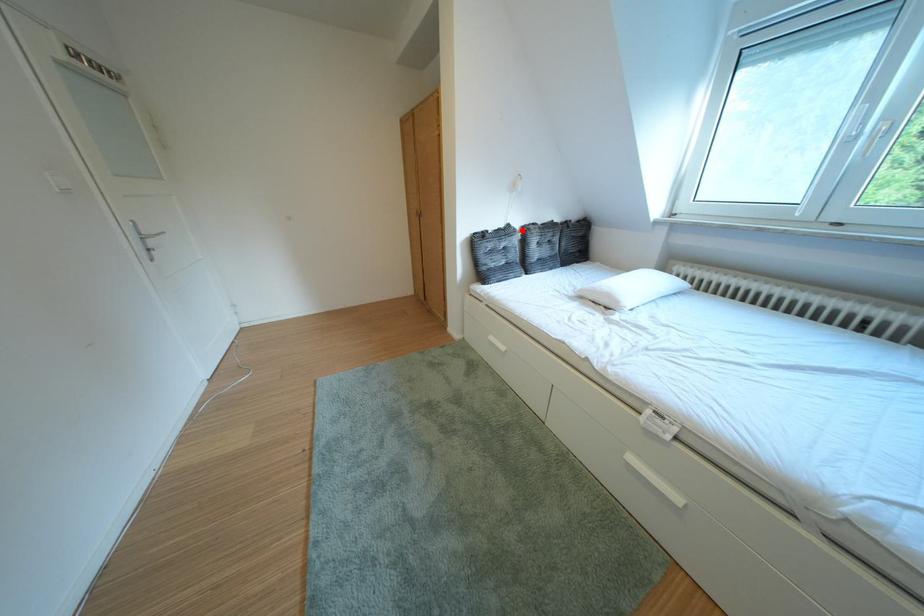
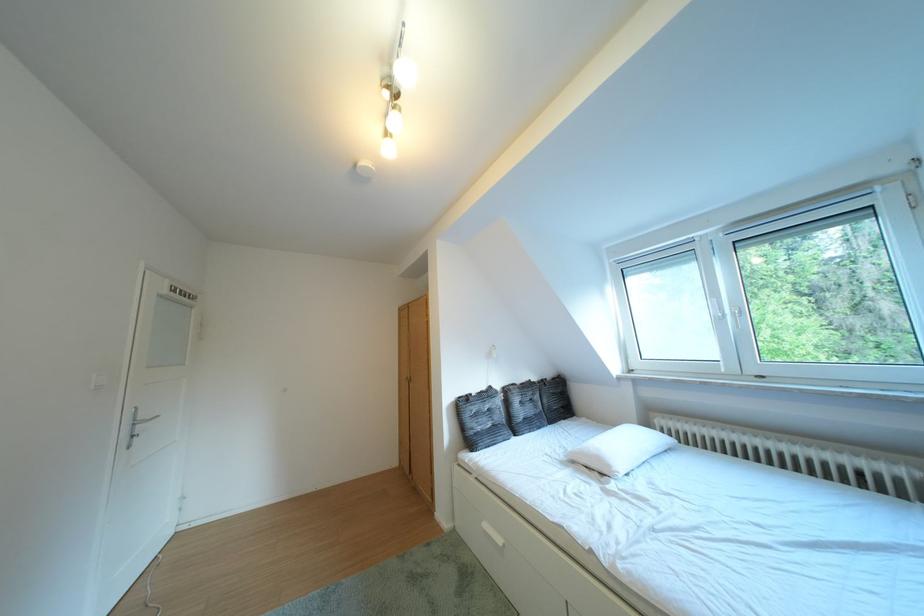
Question: I am providing you with two images of the same scene from different viewpoints. In image1, a red point is highlighted. Considering the same 3D point in image2, which of the following is correct?

Choices:
 (A) It is closer
 (B) It is farther

Answer: (B)